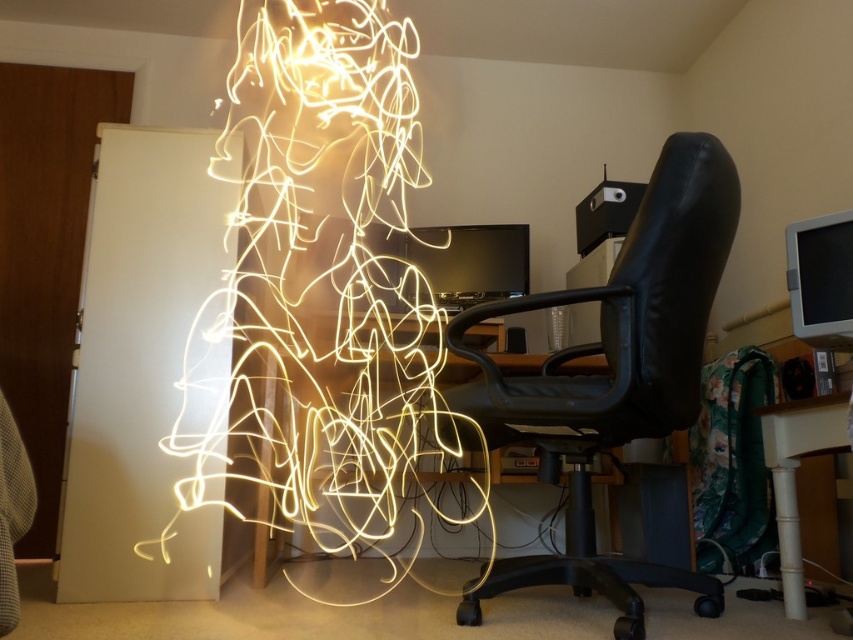
Between black leather swivel chair at center and white glossy table at lower right, which one is positioned lower?

white glossy table at lower right

Locate an element on the screen. black leather swivel chair at center is located at coordinates (614, 376).

Find the location of a particular element. The width and height of the screenshot is (853, 640). black leather swivel chair at center is located at coordinates (614, 376).